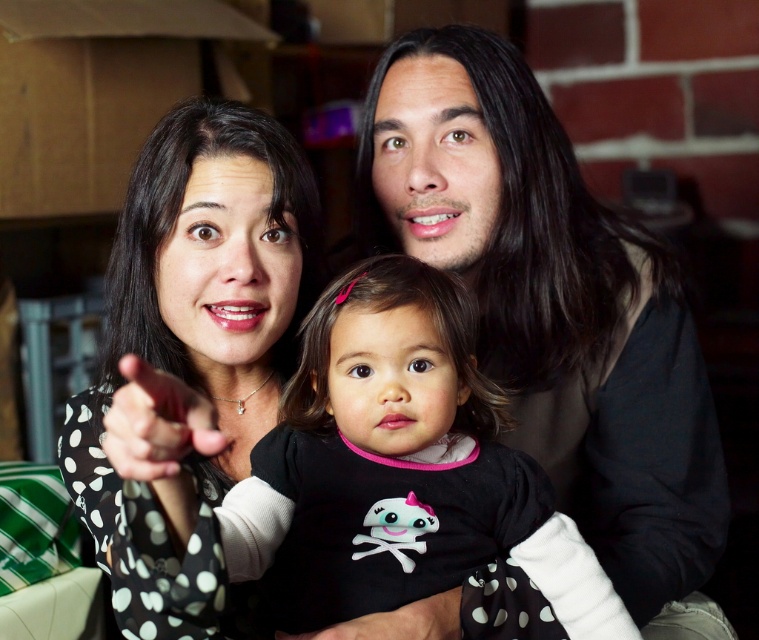
Does black polka dot onesie at center have a larger size compared to black dotted shirt at center?

No, black polka dot onesie at center is not bigger than black dotted shirt at center.

Is point (638, 634) farther from viewer compared to point (276, 257)?

No, (638, 634) is in front of (276, 257).

Is point (383, 355) less distant than point (71, 406)?

Yes, it is in front of point (71, 406).

Locate an element on the screen. Image resolution: width=759 pixels, height=640 pixels. black polka dot onesie at center is located at coordinates (398, 468).

Is smooth black shirt at center above black polka dot onesie at center?

Indeed, smooth black shirt at center is positioned over black polka dot onesie at center.

Who is shorter, smooth black shirt at center or black polka dot onesie at center?

black polka dot onesie at center is shorter.

Locate an element on the screen. smooth black shirt at center is located at coordinates (556, 310).

Which is below, smooth black shirt at center or black dotted shirt at center?

Positioned lower is smooth black shirt at center.

Is smooth black shirt at center closer to the viewer compared to black dotted shirt at center?

No, it is not.

Is point (666, 456) positioned before point (216, 497)?

No, (666, 456) is further to viewer.

What are the coordinates of `smooth black shirt at center` in the screenshot? It's located at (556, 310).